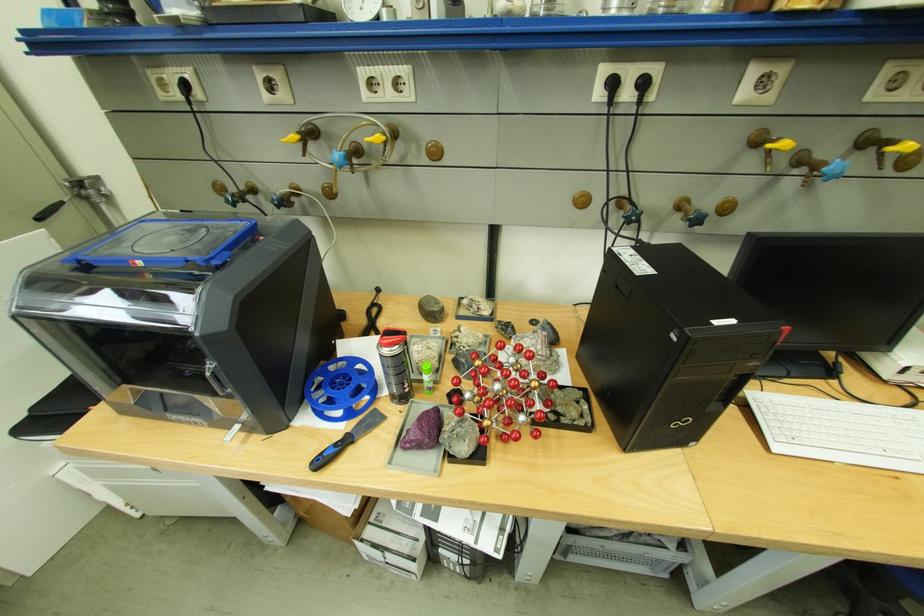
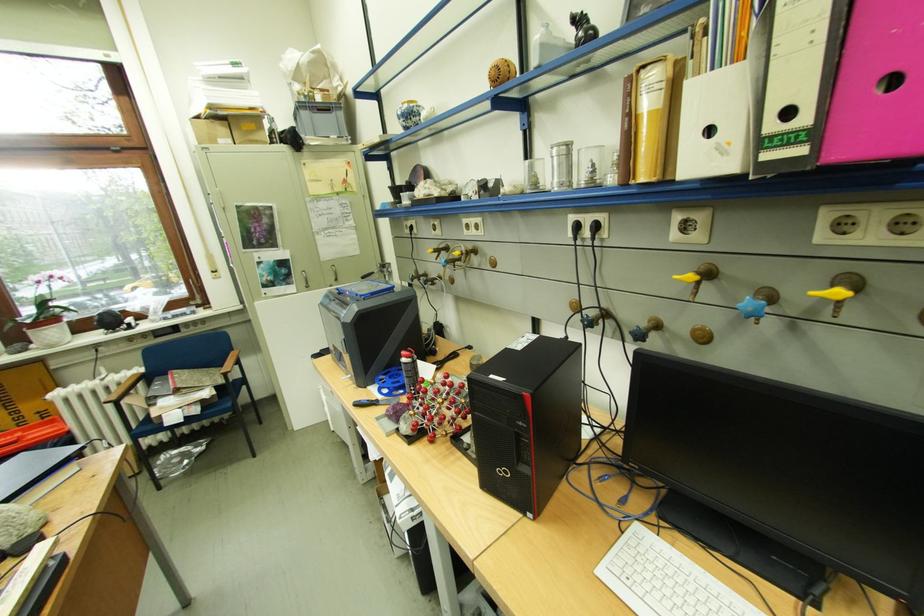
Locate, in the second image, the point that corresponds to [475,448] in the first image.

(415, 429)